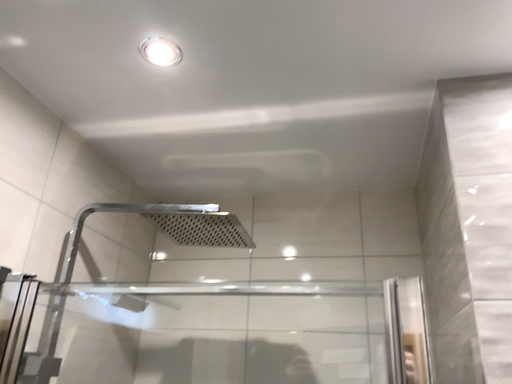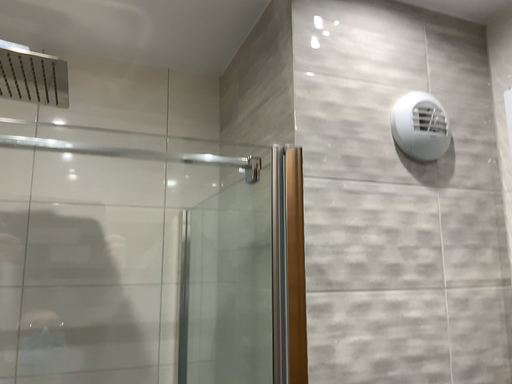
Question: How did the camera likely rotate when shooting the video?

Choices:
 (A) rotated left
 (B) rotated right

Answer: (B)